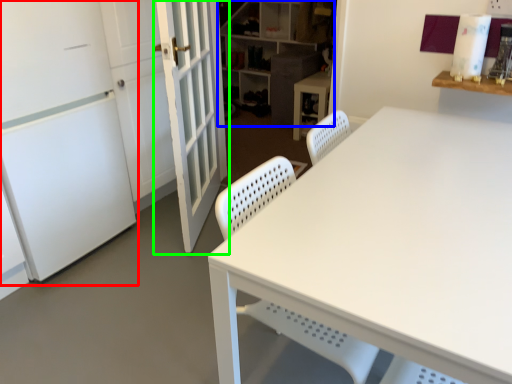
Question: Which object is the farthest from screen door (highlighted by a red box)? Choose among these: shelf (highlighted by a blue box) or door (highlighted by a green box).

Choices:
 (A) shelf
 (B) door

Answer: (A)